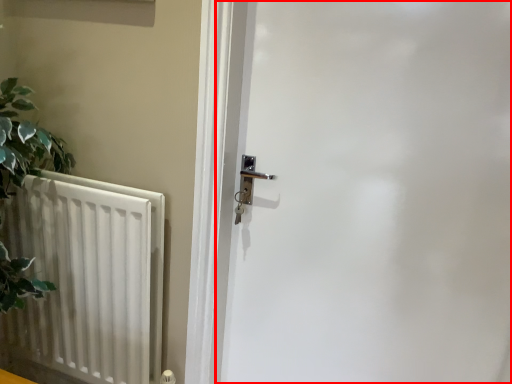
Question: From the image's perspective, what is the correct spatial relationship of door (annotated by the red box) in relation to radiator?

Choices:
 (A) below
 (B) above

Answer: (B)